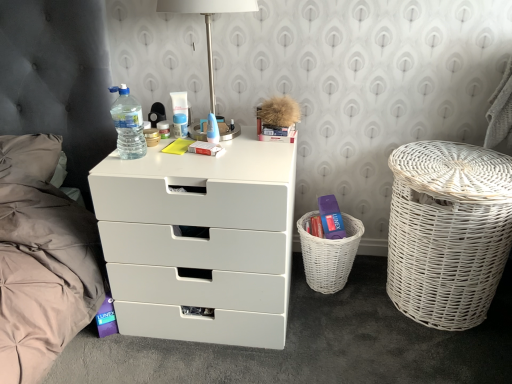
You are a GUI agent. You are given a task and a screenshot of the screen. Output one action in this format:
    pyautogui.click(x=<x>, y=<y>)
    Task: Click on the vacant area that is in front of white wicker basket at lower right
    The width and height of the screenshot is (512, 384).
    Given the screenshot: What is the action you would take?
    pyautogui.click(x=339, y=320)